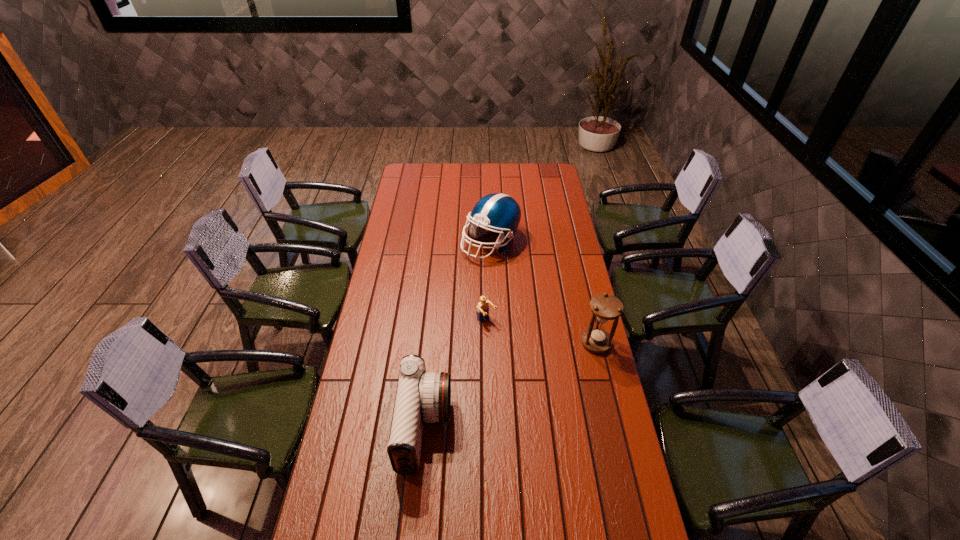
Locate an element on the screen. free space on the desktop that is between the nearest object and the rightmost object and is positioned on the face of the Lego is located at coordinates (538, 372).

I want to click on vacant space on the desktop that is between the nearest object and the second nearest object and is positioned at the front of the football helmet with the faceguard, so click(500, 390).